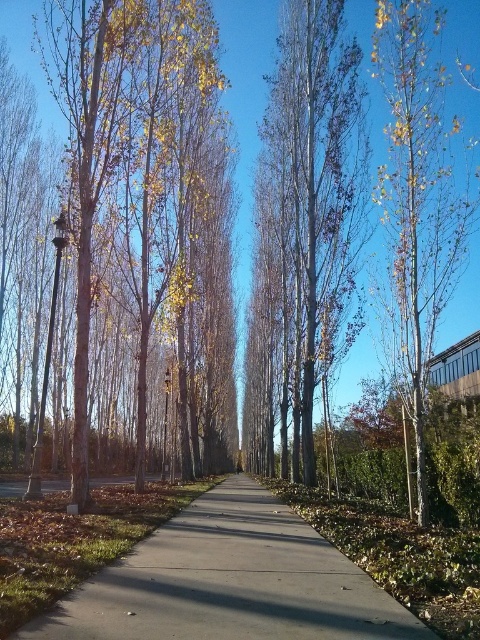
Who is more forward, (214, 312) or (317, 108)?

Point (317, 108) is more forward.

I want to click on yellow-green foliage at center, so click(x=164, y=230).

The image size is (480, 640). Find the location of `yellow-green foliage at center`. yellow-green foliage at center is located at coordinates (164, 230).

Who is more distant from viewer, (192, 116) or (445, 168)?

The point (192, 116) is more distant.

Is point (218, 289) farther from viewer compared to point (422, 186)?

Yes, point (218, 289) is behind point (422, 186).

Locate an element on the screen. yellow-green foliage at center is located at coordinates [164, 230].

Between smooth silver birch tree at center and smooth white birch at right, which one appears on the right side from the viewer's perspective?

smooth white birch at right is more to the right.

Can you confirm if smooth silver birch tree at center is positioned above smooth white birch at right?

Actually, smooth silver birch tree at center is below smooth white birch at right.

Is point (313, 29) farther from camera compared to point (393, 195)?

That is True.

Find the location of a particular element. smooth silver birch tree at center is located at coordinates (304, 230).